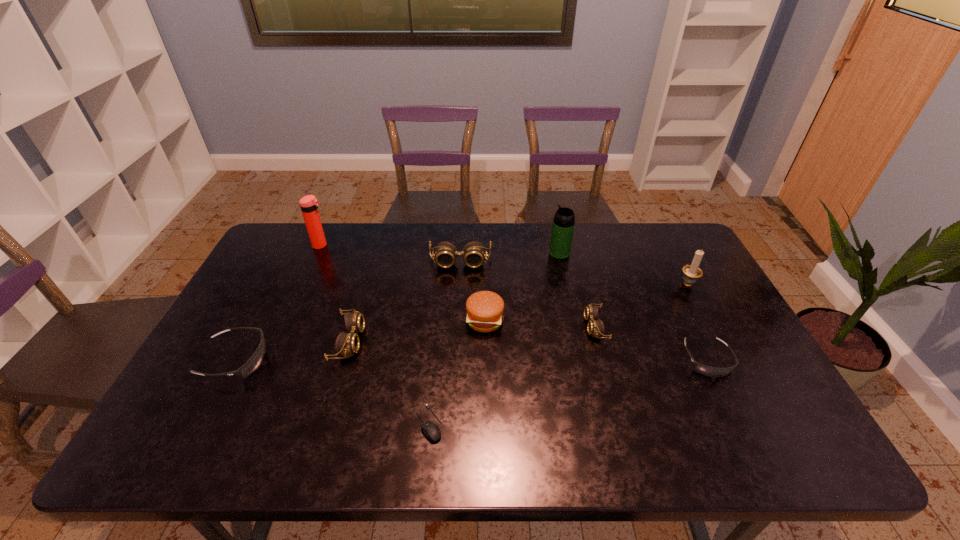
Find the location of a particular element. the left thermos bottle is located at coordinates (308, 204).

You are a GUI agent. You are given a task and a screenshot of the screen. Output one action in this format:
    pyautogui.click(x=<x>, y=<y>)
    Task: Click on the green thermos bottle
    
    Given the screenshot: What is the action you would take?
    pyautogui.click(x=564, y=220)

Find the location of a particular element. The width and height of the screenshot is (960, 540). the eighth shortest object is located at coordinates (691, 272).

At what (x,y) coordinates should I click in order to perform the action: click on the fourth farthest object. Please return your answer as a coordinate pair (x, y). Image resolution: width=960 pixels, height=540 pixels. Looking at the image, I should click on (691, 272).

You are a GUI agent. You are given a task and a screenshot of the screen. Output one action in this format:
    pyautogui.click(x=<x>, y=<y>)
    Task: Click on the biggest brown goggles
    The width and height of the screenshot is (960, 540).
    Given the screenshot: What is the action you would take?
    pyautogui.click(x=473, y=253)

Where is `the farthest goggles`? the farthest goggles is located at coordinates (473, 253).

Where is `hamburger`? hamburger is located at coordinates (484, 310).

This screenshot has width=960, height=540. I want to click on the second biggest brown goggles, so click(348, 343).

Where is `the sixth tallest object`? the sixth tallest object is located at coordinates (348, 343).

At what (x,y) coordinates should I click in order to perform the action: click on the left black goggles. Please return your answer as a coordinate pair (x, y). Looking at the image, I should click on (254, 362).